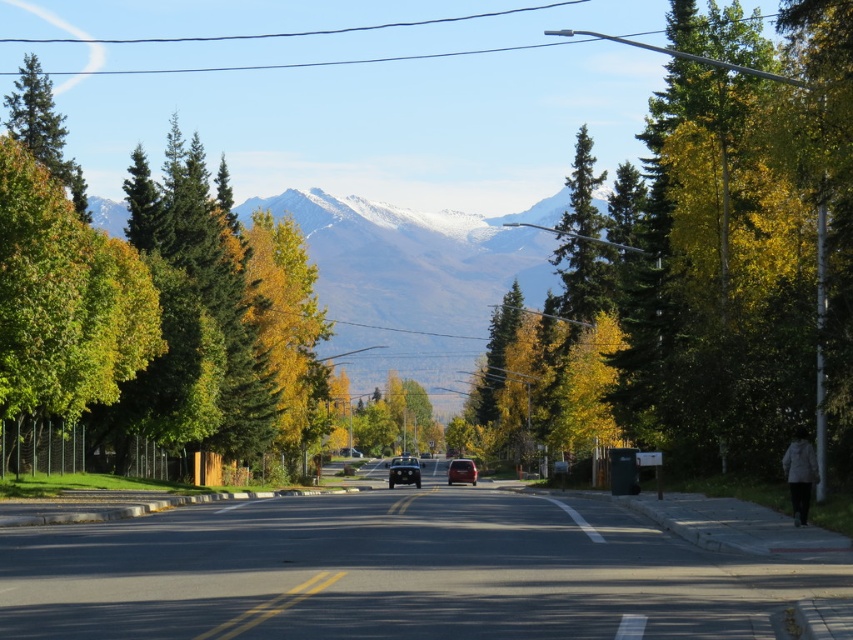
You are standing on the road and want to walk towards the mountain range in the background. There are two points marked on the right side of the road at coordinates point (306, 262) and point (403, 506). Which point should you aim for if you want to reach the mountain range first?

You should aim for point (403, 506) because it is closer to the mountain range than point (306, 262), which is further away from the mountains.